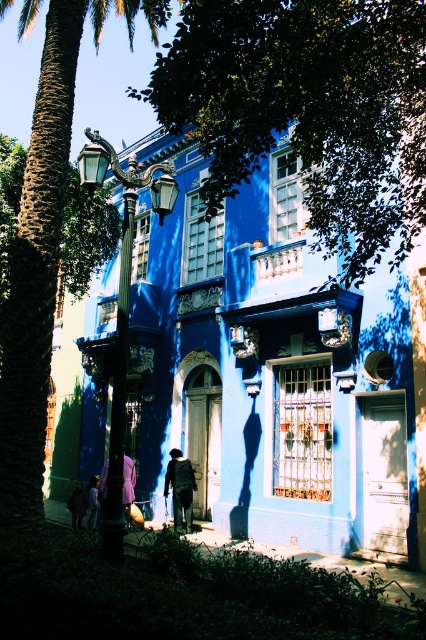
Question: Is dark blue fabric jacket at center below light brown fabric pants at lower left?

Choices:
 (A) no
 (B) yes

Answer: (A)

Question: Which of the following is the farthest from the observer?

Choices:
 (A) green leafy palm tree at left
 (B) light brown fabric pants at lower left
 (C) light purple fabric at lower left
 (D) dark blue fabric jacket at center

Answer: (B)

Question: From the image, what is the correct spatial relationship of green leafy tree at upper center in relation to dark blue fabric jacket at center?

Choices:
 (A) below
 (B) above

Answer: (B)

Question: Which point appears farthest from the camera in this image?

Choices:
 (A) (71, 500)
 (B) (328, 58)
 (C) (36, 323)

Answer: (A)

Question: Can you confirm if dark blue fabric jacket at center is smaller than light brown fabric pants at lower left?

Choices:
 (A) no
 (B) yes

Answer: (A)

Question: Among these objects, which one is farthest from the camera?

Choices:
 (A) green leafy tree at upper center
 (B) dark blue fabric jacket at lower left
 (C) green leafy palm tree at left
 (D) light purple fabric at lower left

Answer: (B)